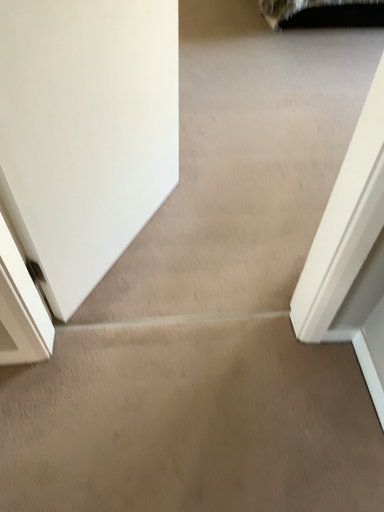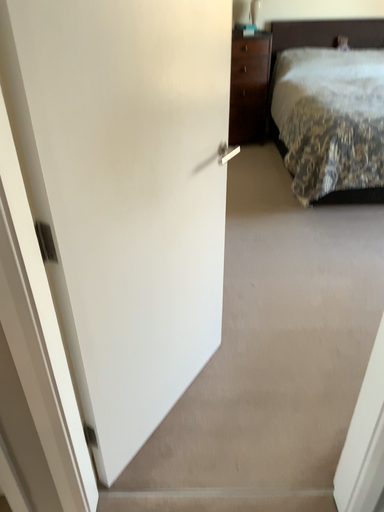
Question: Which way did the camera rotate in the video?

Choices:
 (A) rotated upward
 (B) rotated downward

Answer: (A)